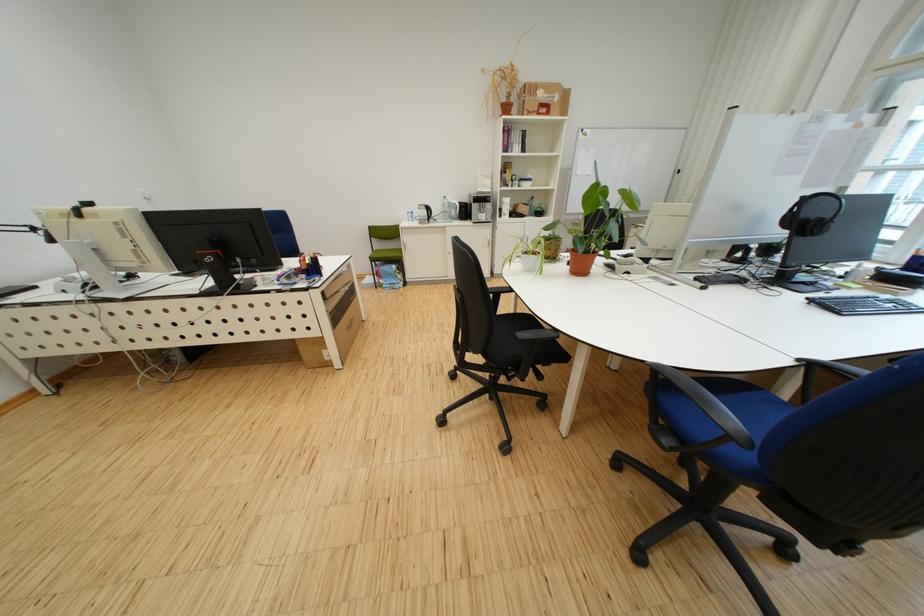
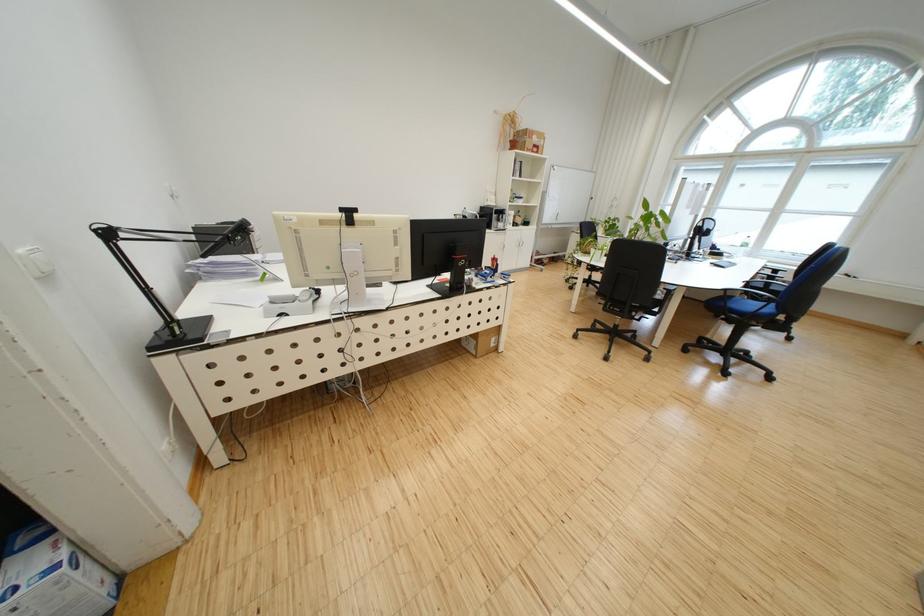
Locate, in the second image, the point that corresponds to [319,447] in the first image.

(572, 395)